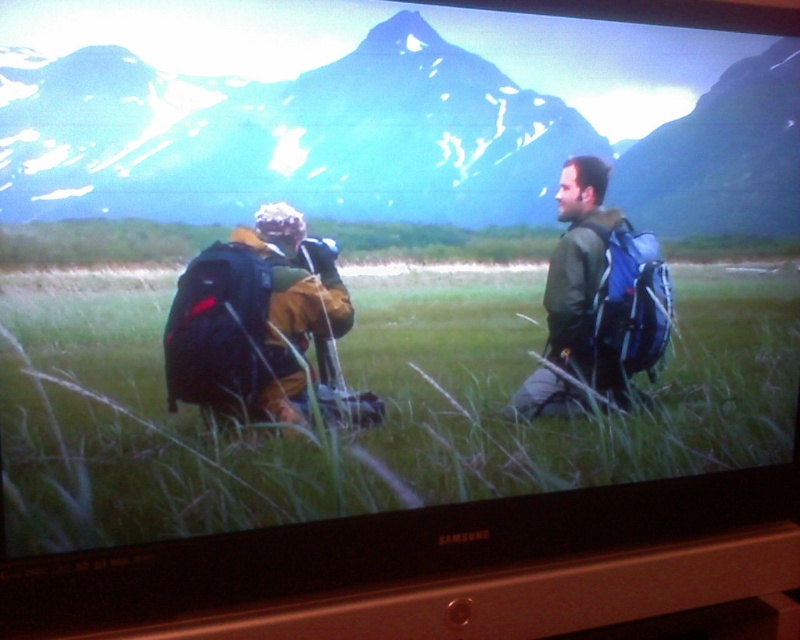
Question: Which object appears farthest from the camera in this image?

Choices:
 (A) matte black backpack at center
 (B) green grass at center

Answer: (A)

Question: Is green grass at center above green matte jacket at right?

Choices:
 (A) no
 (B) yes

Answer: (A)

Question: Is sleek blue mountain at upper center above green matte jacket at right?

Choices:
 (A) no
 (B) yes

Answer: (B)

Question: Which point is closer to the camera taking this photo?

Choices:
 (A) (556, 328)
 (B) (690, 417)
 (C) (178, 161)
 (D) (212, 257)

Answer: (C)

Question: Among these points, which one is nearest to the camera?

Choices:
 (A) (124, 316)
 (B) (220, 35)
 (C) (566, 170)
 (D) (574, 298)

Answer: (B)

Question: Is green grass at center to the left of matte black backpack at center from the viewer's perspective?

Choices:
 (A) yes
 (B) no

Answer: (A)